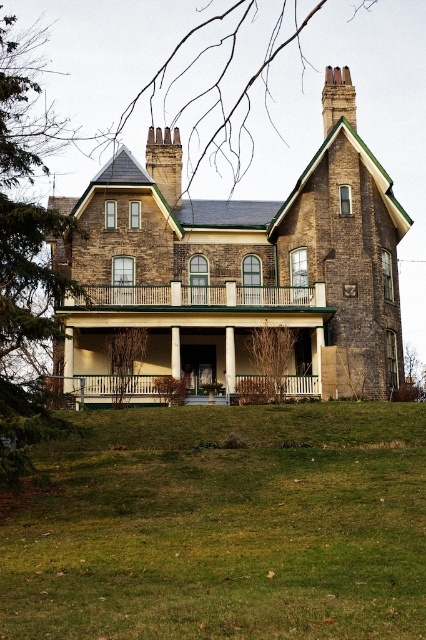
You are standing in front of the house and notice a point marked at coordinates point (124,358). Based on the scene description, can you determine what this point is located on?

The point (124,358) is located on bare branches at lower left.

You are standing at the base of the house and looking towards the front door. There are two points marked on the house wall. The first point is at coordinates point (374, 627) and the second point is at coordinates point (141, 353). Which point appears closer to you when viewed from this position?

Point (374, 627) is in front of point (141, 353), so it appears closer to you when viewed from the base of the house.